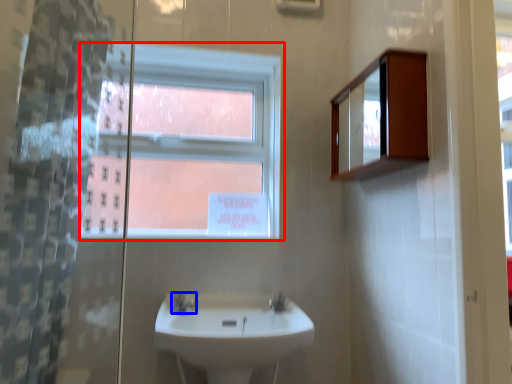
Question: Which object is further to the camera taking this photo, window (highlighted by a red box) or tap (highlighted by a blue box)?

Choices:
 (A) window
 (B) tap

Answer: (A)